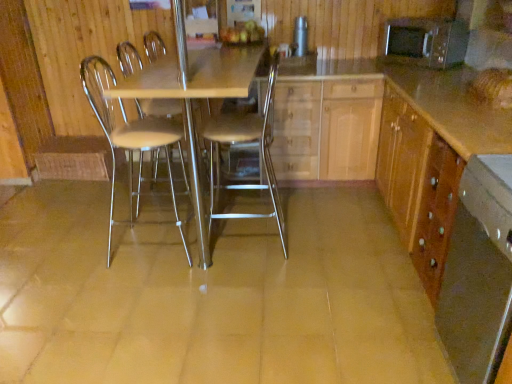
Find the location of a particular element. The height and width of the screenshot is (384, 512). free space behind metallic silver chair at center, which appears as the 1th chair when viewed from the left is located at coordinates (152, 213).